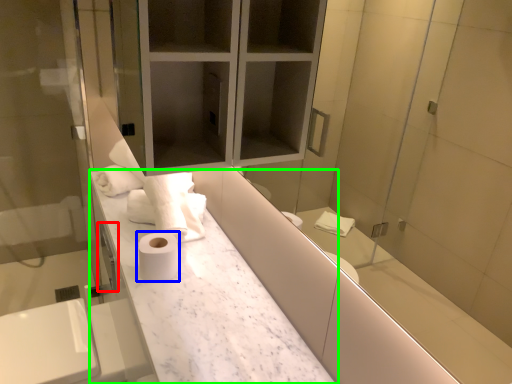
Question: Which is nearer to the faucet (highlighted by a red box)? toilet paper (highlighted by a blue box) or counter (highlighted by a green box).

Choices:
 (A) toilet paper
 (B) counter

Answer: (A)